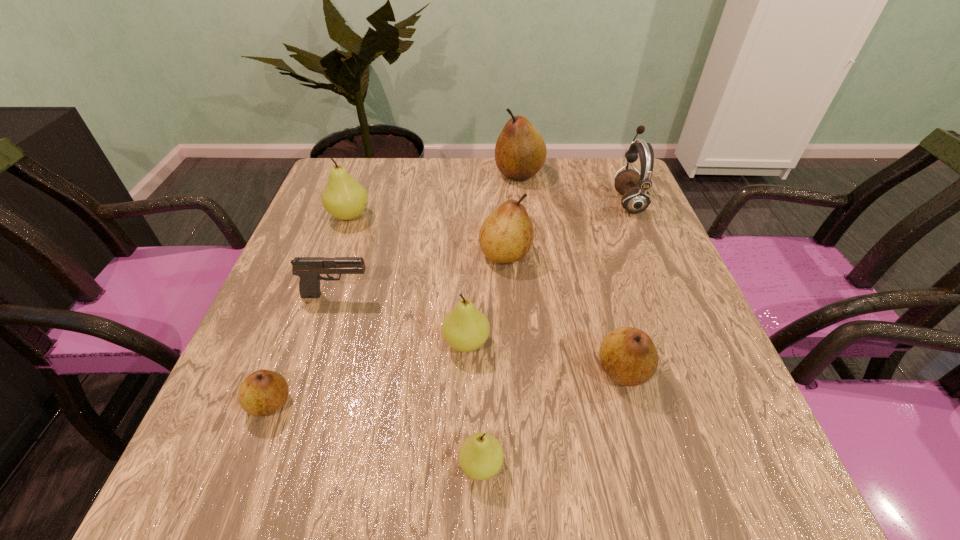
Image resolution: width=960 pixels, height=540 pixels. I want to click on free space that is in between the brown earphone and the leftmost green pear, so [489, 208].

Locate an element on the screen. free space between the second farthest brown pear and the rightmost object is located at coordinates (566, 228).

The height and width of the screenshot is (540, 960). What are the coordinates of `blank region between the leftmost green pear and the leftmost brown pear` in the screenshot? It's located at click(x=309, y=309).

Identify the location of vacant space that's between the leftmost brown pear and the biggest green pear. This screenshot has height=540, width=960. (309, 309).

Where is `vacant area that lies between the rightmost object and the third biggest brown pear`? This screenshot has width=960, height=540. vacant area that lies between the rightmost object and the third biggest brown pear is located at coordinates (626, 286).

You are a GUI agent. You are given a task and a screenshot of the screen. Output one action in this format:
    pyautogui.click(x=<x>, y=<y>)
    Task: Click on the unoccupied position between the second farthest green pear and the pistol
    This screenshot has width=960, height=540.
    Given the screenshot: What is the action you would take?
    pyautogui.click(x=401, y=319)

Locate an element on the screen. This screenshot has height=540, width=960. vacant point located between the leftmost green pear and the second object from right to left is located at coordinates (486, 293).

At what (x,y) coordinates should I click in order to perform the action: click on free space between the second smallest brown pear and the sixth nearest object. Please return your answer as a coordinate pair (x, y). Image resolution: width=960 pixels, height=540 pixels. Looking at the image, I should click on (564, 312).

Locate an element on the screen. object that can be found as the fifth closest to the fifth nearest object is located at coordinates (480, 457).

Identify which object is located as the fifth nearest to the nearest green pear. Please provide its 2D coordinates. Your answer should be formatted as a tuple, i.e. [(x, y)], where the tuple contains the x and y coordinates of a point satisfying the conditions above.

[(506, 236)]